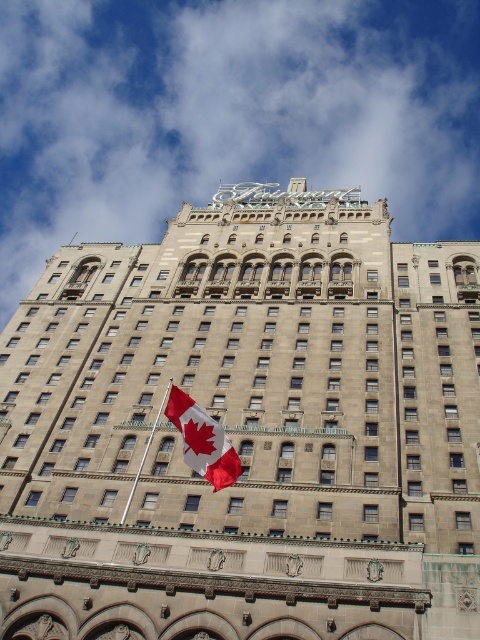
You are standing at the entrance of the Fairmont hotel and notice the Canadian flag in the foreground. Where is the stone textured building at center relative to the Canadian flag?

The stone textured building at center is located at point (245, 429) relative to the Canadian flag in the foreground.